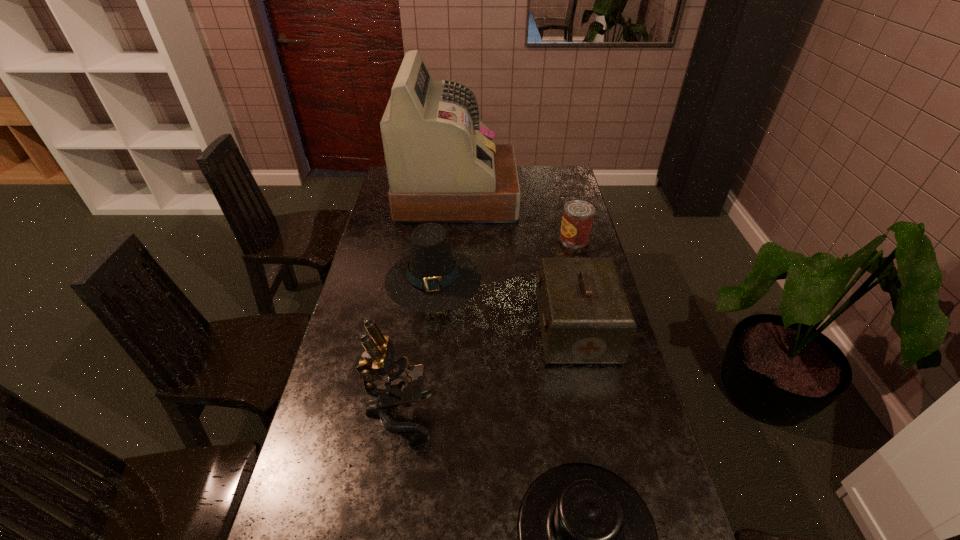
The height and width of the screenshot is (540, 960). What are the coordinates of `free spot that satisfies the following two spatial constraints: 1. on the operating side of the first-aid kit; 2. on the right side of the cash register` in the screenshot? It's located at (447, 329).

This screenshot has height=540, width=960. I want to click on vacant space that satisfies the following two spatial constraints: 1. on the operating side of the tallest object; 2. on the left side of the fifth tallest object, so (454, 238).

Identify the location of vacant point that satisfies the following two spatial constraints: 1. on the operating side of the cash register; 2. on the left side of the first-aid kit. (447, 329).

At what (x,y) coordinates should I click in order to perform the action: click on blank space that satisfies the following two spatial constraints: 1. on the operating side of the first-aid kit; 2. on the left side of the cash register. Please return your answer as a coordinate pair (x, y). Looking at the image, I should click on (447, 329).